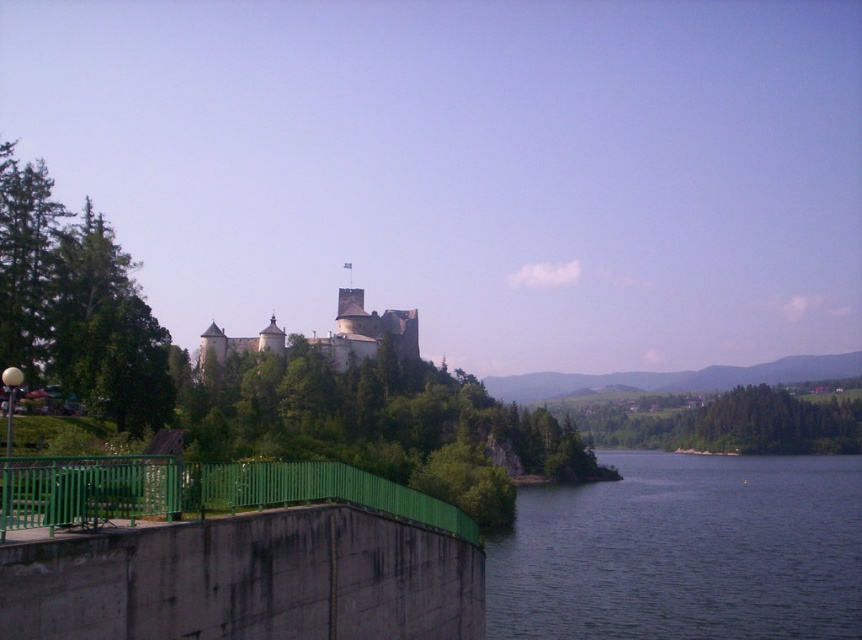
Can you confirm if dark blue water at lower right is smaller than green metallic fence at lower left?

Actually, dark blue water at lower right might be larger than green metallic fence at lower left.

How distant is dark blue water at lower right from green metallic fence at lower left?

dark blue water at lower right and green metallic fence at lower left are 100.34 meters apart.

Is point (786, 515) closer to camera compared to point (325, 465)?

That is False.

You are a GUI agent. You are given a task and a screenshot of the screen. Output one action in this format:
    pyautogui.click(x=<x>, y=<y>)
    Task: Click on the dark blue water at lower right
    The width and height of the screenshot is (862, 640).
    Given the screenshot: What is the action you would take?
    pyautogui.click(x=684, y=552)

Consider the image. Who is lower down, green metallic fence at lower left or stone castle at center?

green metallic fence at lower left is lower down.

Which is above, green metallic fence at lower left or stone castle at center?

stone castle at center

Locate an element on the screen. green metallic fence at lower left is located at coordinates (197, 492).

I want to click on green metallic fence at lower left, so click(x=197, y=492).

Which is below, dark blue water at lower right or stone castle at center?

dark blue water at lower right is below.

Is dark blue water at lower right shorter than stone castle at center?

Incorrect, dark blue water at lower right's height does not fall short of stone castle at center's.

In order to click on dark blue water at lower right in this screenshot , I will do `click(684, 552)`.

At what (x,y) coordinates should I click in order to perform the action: click on dark blue water at lower right. Please return your answer as a coordinate pair (x, y). The height and width of the screenshot is (640, 862). Looking at the image, I should click on [x=684, y=552].